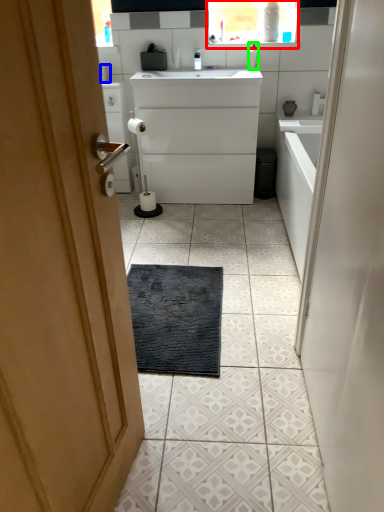
Question: Which object is the closest to the medicine cabinet (highlighted by a red box)? Choose among these: toilet paper (highlighted by a blue box) or toiletry (highlighted by a green box).

Choices:
 (A) toilet paper
 (B) toiletry

Answer: (B)